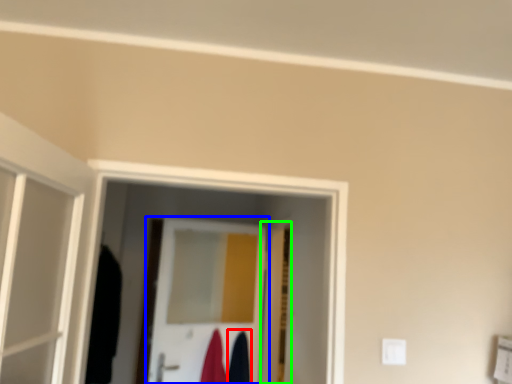
Question: Which is farther away from robe (highlighted by a red box)? door (highlighted by a blue box) or door (highlighted by a green box)?

Choices:
 (A) door
 (B) door

Answer: (B)